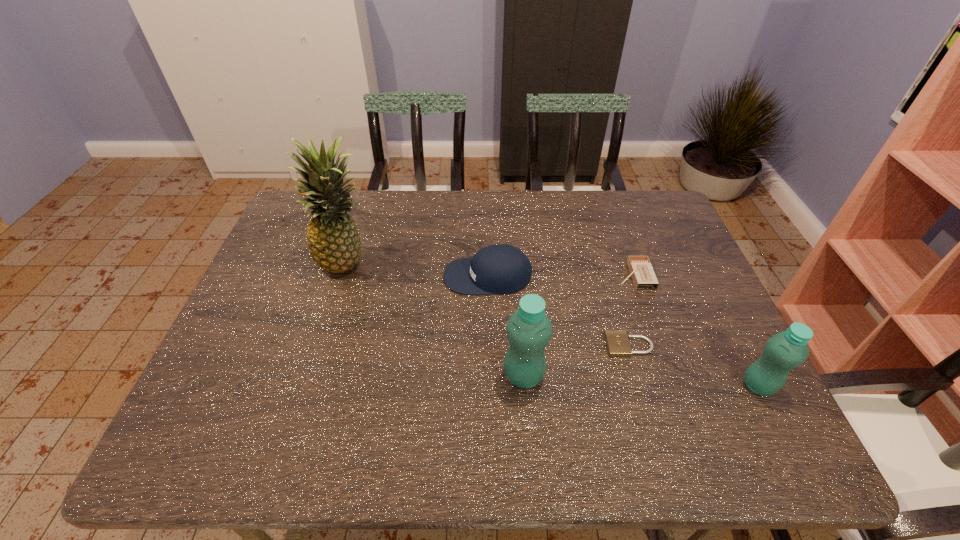
Find the location of `vacant region located on the front-facing side of the baseball cap`. vacant region located on the front-facing side of the baseball cap is located at coordinates (408, 276).

Find the location of a particular element. The width and height of the screenshot is (960, 540). blank area located on the front-facing side of the baseball cap is located at coordinates (412, 276).

In order to click on object that is at the left edge in this screenshot , I will do `click(333, 240)`.

Identify the location of water bottle that is at the right edge. (786, 350).

This screenshot has width=960, height=540. What are the coordinates of `matchbox positioned at the right edge` in the screenshot? It's located at (641, 270).

In order to click on object that is at the near right corner in this screenshot , I will do `click(786, 350)`.

In the image, there is a desktop. Identify the location of vacant space at the far edge. Image resolution: width=960 pixels, height=540 pixels. (540, 207).

You are a GUI agent. You are given a task and a screenshot of the screen. Output one action in this format:
    pyautogui.click(x=<x>, y=<y>)
    Task: Click on the free space at the near edge of the desktop
    The image size is (960, 540).
    Given the screenshot: What is the action you would take?
    [x=468, y=389]

The width and height of the screenshot is (960, 540). Identify the location of free space at the left edge. (256, 291).

Locate an element on the screen. blank space at the right edge of the desktop is located at coordinates (689, 335).